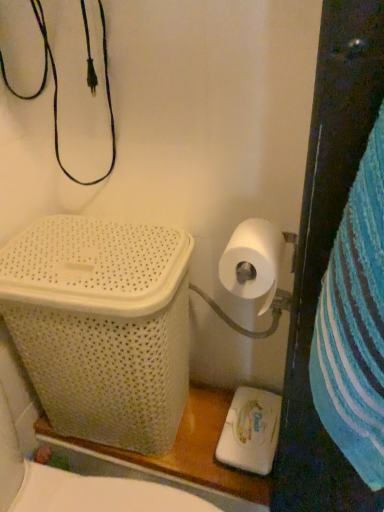
Question: Considering the relative positions of white matte toilet paper at right and white woven laundry basket at left in the image provided, is white matte toilet paper at right to the left or to the right of white woven laundry basket at left?

Choices:
 (A) right
 (B) left

Answer: (A)

Question: From a real-world perspective, relative to white woven laundry basket at left, is white matte toilet paper at right vertically above or below?

Choices:
 (A) below
 (B) above

Answer: (B)

Question: Looking at the image, does white matte toilet paper at right seem bigger or smaller compared to white woven laundry basket at left?

Choices:
 (A) big
 (B) small

Answer: (B)

Question: From a real-world perspective, is white woven laundry basket at left above or below white matte toilet paper at right?

Choices:
 (A) below
 (B) above

Answer: (A)

Question: From the image's perspective, is white woven laundry basket at left positioned above or below white matte toilet paper at right?

Choices:
 (A) below
 (B) above

Answer: (A)

Question: Is white woven laundry basket at left bigger or smaller than white matte toilet paper at right?

Choices:
 (A) small
 (B) big

Answer: (B)

Question: Would you say white woven laundry basket at left is to the left or to the right of white matte toilet paper at right in the picture?

Choices:
 (A) right
 (B) left

Answer: (B)